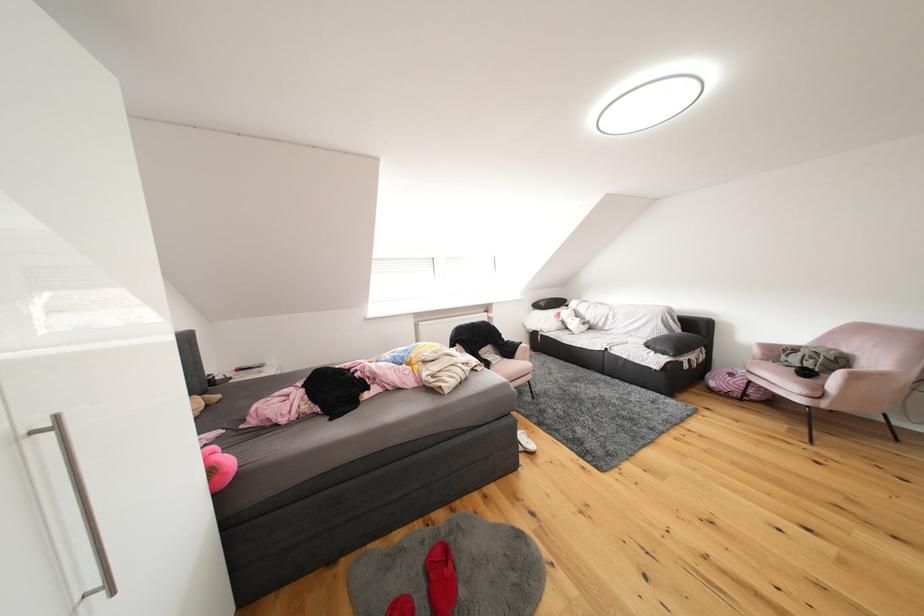
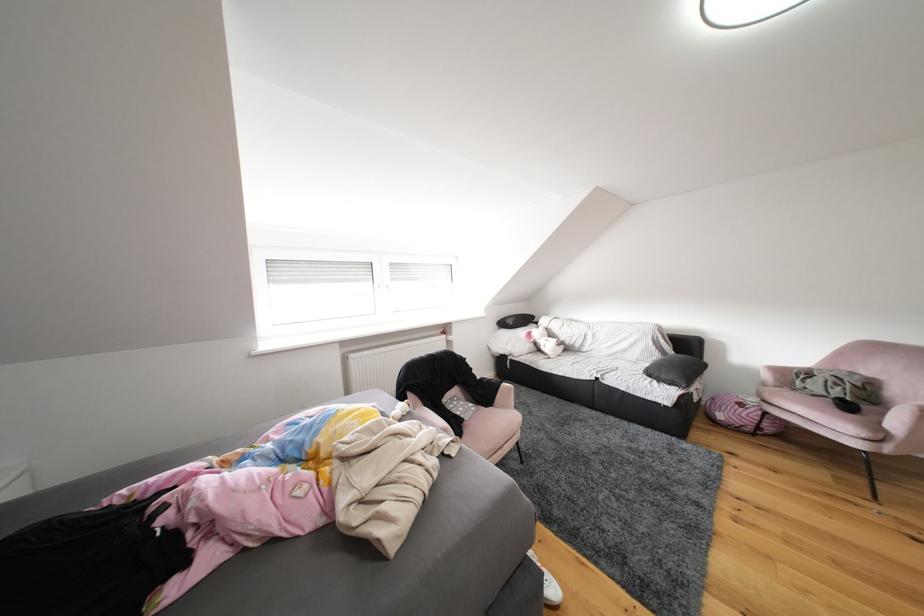
Question: The camera is either moving clockwise (left) or counter-clockwise (right) around the object. The first image is from the beginning of the video and the second image is from the end. Is the camera moving left or right when shooting the video?

Choices:
 (A) Left
 (B) Right

Answer: (A)